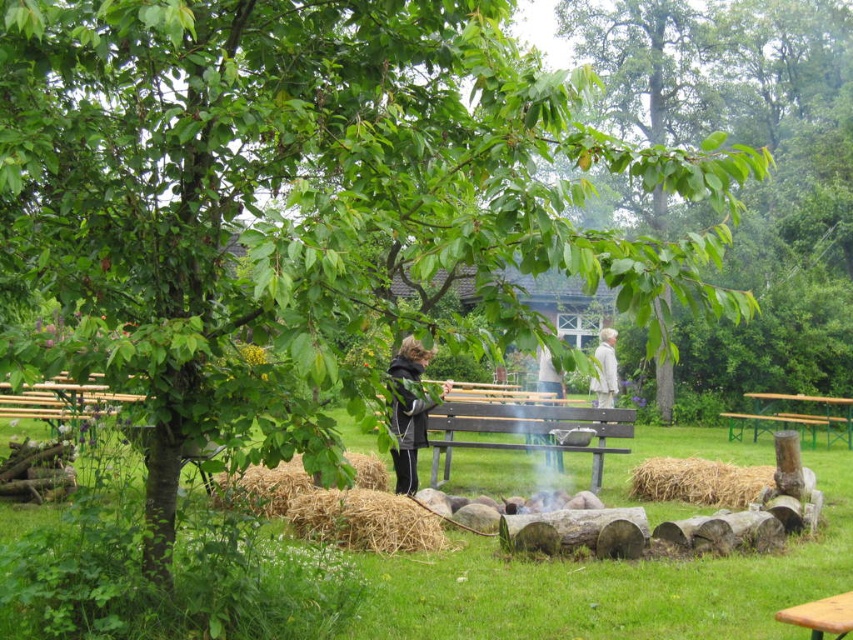
You are planning to set up a small picnic area in the park. You have a picnic blanket that needs to be placed between the wooden bench at center and the brown straw bale at center. Based on their positions, which object should the blanket be closer to?

The wooden bench at center is to the left of brown straw bale at center, so the picnic blanket should be placed closer to the wooden bench at center to be between them.

You are standing at the tree trunk and want to walk to the point marked as point (749,396). There is an obstacle at point (409,426). Will you encounter the obstacle before reaching your destination?

Yes, you will encounter the obstacle at point (409,426) before reaching point (749,396) because point (409,426) is in front of point (749,396).